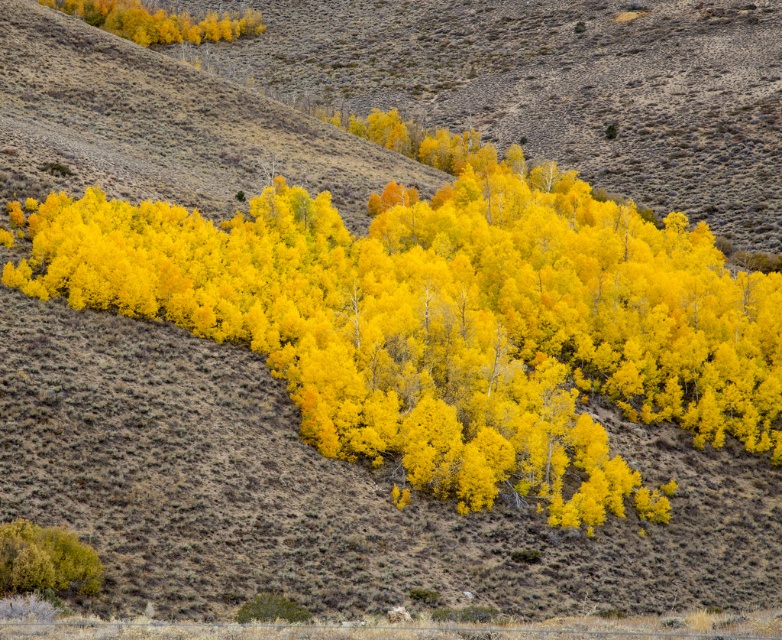
Who is lower down, green leafy bush at lower left or golden yellow leaves at upper left?

green leafy bush at lower left

Is green leafy bush at lower left wider than golden yellow leaves at upper left?

In fact, green leafy bush at lower left might be narrower than golden yellow leaves at upper left.

Is point (74, 538) less distant than point (250, 20)?

Yes.

Find the location of a particular element. The height and width of the screenshot is (640, 782). green leafy bush at lower left is located at coordinates (45, 560).

Is yellow leafy trees at center wider than green leafy bush at lower left?

Indeed, yellow leafy trees at center has a greater width compared to green leafy bush at lower left.

In the scene shown: Can you confirm if yellow leafy trees at center is taller than green leafy bush at lower left?

Correct, yellow leafy trees at center is much taller as green leafy bush at lower left.

You are a GUI agent. You are given a task and a screenshot of the screen. Output one action in this format:
    pyautogui.click(x=<x>, y=<y>)
    Task: Click on the yellow leafy trees at center
    This screenshot has width=782, height=640.
    Given the screenshot: What is the action you would take?
    pyautogui.click(x=449, y=320)

Does yellow leafy trees at center appear over golden yellow leaves at upper left?

Incorrect, yellow leafy trees at center is not positioned above golden yellow leaves at upper left.

Can you confirm if yellow leafy trees at center is taller than golden yellow leaves at upper left?

Yes.

Describe the element at coordinates (449, 320) in the screenshot. This screenshot has height=640, width=782. I see `yellow leafy trees at center` at that location.

The height and width of the screenshot is (640, 782). In order to click on yellow leafy trees at center in this screenshot , I will do `click(449, 320)`.